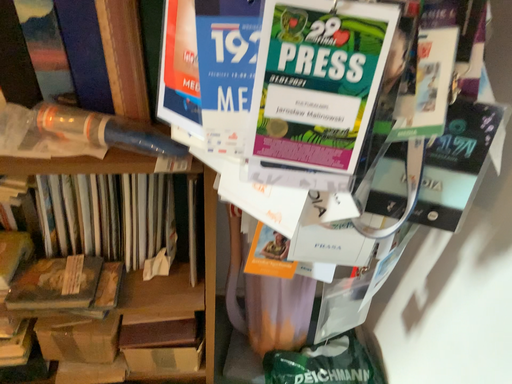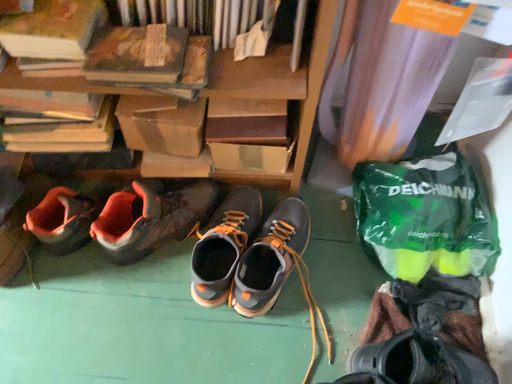
Question: Which way did the camera rotate in the video?

Choices:
 (A) rotated left
 (B) rotated right

Answer: (A)